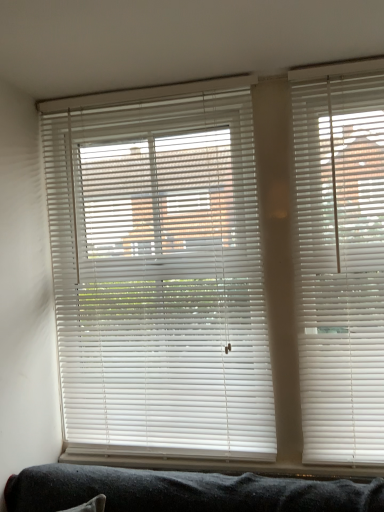
Question: Should I look upward or downward to see white plastic blinds at right, the 1th window blind viewed from the front?

Choices:
 (A) down
 (B) up

Answer: (A)

Question: Does white matte blinds at center, which ranks as the second window blind in front-to-back order, have a smaller size compared to white plastic blinds at right, the second window blind when ordered from back to front?

Choices:
 (A) no
 (B) yes

Answer: (A)

Question: Is white matte blinds at center, which appears as the second window blind when viewed from the right, wider than white plastic blinds at right, marked as the second window blind in a left-to-right arrangement?

Choices:
 (A) no
 (B) yes

Answer: (A)

Question: Would you say white matte blinds at center, which is counted as the 1th window blind, starting from the back, is outside white plastic blinds at right, the second window blind when ordered from back to front?

Choices:
 (A) no
 (B) yes

Answer: (B)

Question: Does white matte blinds at center, which ranks as the second window blind in front-to-back order, have a greater height compared to white plastic blinds at right, marked as the second window blind in a left-to-right arrangement?

Choices:
 (A) yes
 (B) no

Answer: (A)

Question: Is white matte blinds at center, which is counted as the 1th window blind, starting from the back, facing towards white plastic blinds at right, the second window blind when ordered from back to front?

Choices:
 (A) no
 (B) yes

Answer: (A)

Question: Does white matte blinds at center, which is counted as the 1th window blind, starting from the back, lie behind white plastic blinds at right, the 1th window blind viewed from the front?

Choices:
 (A) no
 (B) yes

Answer: (B)

Question: Could you tell me if white plastic blinds at right, the 1th window blind when ordered from right to left, is turned towards white matte blinds at center, which ranks as the second window blind in front-to-back order?

Choices:
 (A) no
 (B) yes

Answer: (A)

Question: Considering the relative positions of white plastic blinds at right, the 1th window blind when ordered from right to left, and white matte blinds at center, which ranks as the second window blind in front-to-back order, in the image provided, is white plastic blinds at right, the 1th window blind when ordered from right to left, in front of white matte blinds at center, which ranks as the second window blind in front-to-back order,?

Choices:
 (A) no
 (B) yes

Answer: (B)

Question: From a real-world perspective, is white plastic blinds at right, the 1th window blind when ordered from right to left, over white matte blinds at center, which ranks as the second window blind in front-to-back order?

Choices:
 (A) yes
 (B) no

Answer: (B)

Question: Can you confirm if white plastic blinds at right, the second window blind when ordered from back to front, is positioned to the left of white matte blinds at center, which appears as the second window blind when viewed from the right?

Choices:
 (A) yes
 (B) no

Answer: (B)

Question: From the image's perspective, is white plastic blinds at right, the 1th window blind viewed from the front, below white matte blinds at center, which is counted as the 1th window blind, starting from the back?

Choices:
 (A) yes
 (B) no

Answer: (B)

Question: Is white plastic blinds at right, the 1th window blind viewed from the front, behind white matte blinds at center, which appears as the second window blind when viewed from the right?

Choices:
 (A) yes
 (B) no

Answer: (B)

Question: Is white plastic blinds at right, the 1th window blind viewed from the front, to the left or to the right of white matte blinds at center, which is counted as the 1th window blind, starting from the back, in the image?

Choices:
 (A) left
 (B) right

Answer: (B)